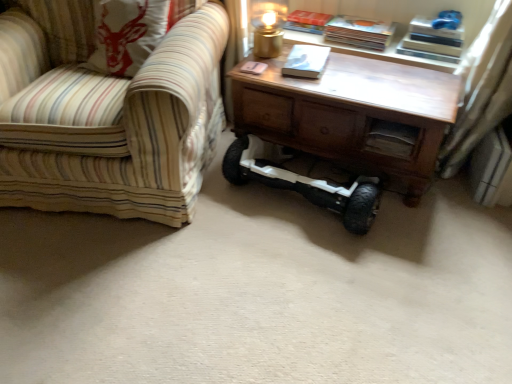
Locate an element on the screen. The height and width of the screenshot is (384, 512). unoccupied region to the right of white matte book at center, positioned as the 3th book in back-to-front order is located at coordinates (355, 72).